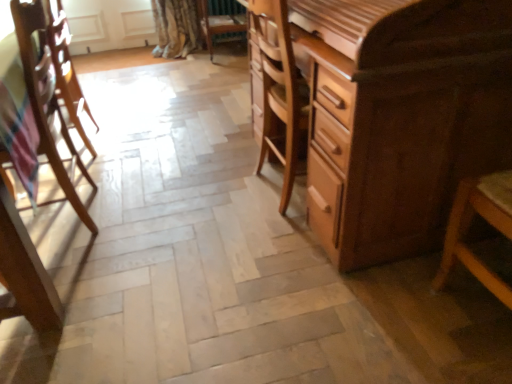
Question: In terms of size, does wooden armchair at left appear bigger or smaller than wooden chair at center, the 2th chair when ordered from bottom to top?

Choices:
 (A) small
 (B) big

Answer: (B)

Question: In terms of width, does wooden armchair at left look wider or thinner when compared to wooden chair at center, the first chair when ordered from top to bottom?

Choices:
 (A) thin
 (B) wide

Answer: (A)

Question: Considering the real-world distances, which object is farthest from the shiny brown wooden chest of drawers at right?

Choices:
 (A) wooden chair at center, which appears as the second chair when viewed from the left
 (B) wooden chair at left, which is the 1th chair in bottom-to-top order
 (C) wooden armchair at left

Answer: (A)

Question: Which of these objects is positioned farthest from the shiny brown wooden chest of drawers at right?

Choices:
 (A) wooden chair at left, placed as the second chair when sorted from right to left
 (B) wooden chair at center, which appears as the second chair when viewed from the left
 (C) wooden armchair at left

Answer: (B)